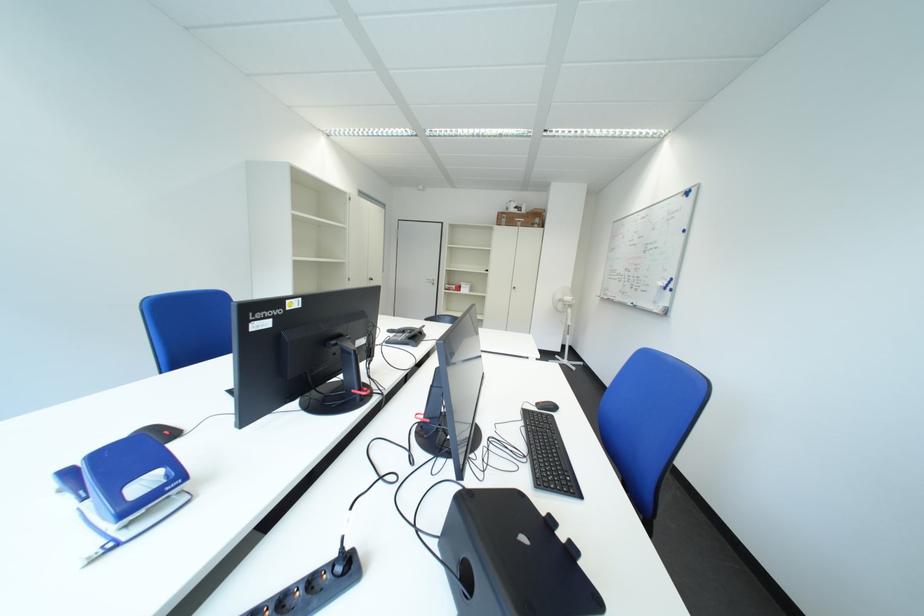
Where is `red whiteboard marker`? The width and height of the screenshot is (924, 616). red whiteboard marker is located at coordinates (616, 302).